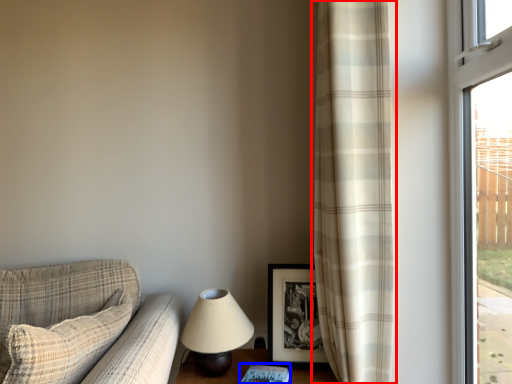
Question: Among these objects, which one is farthest to the camera, curtain (highlighted by a red box) or book (highlighted by a blue box)?

Choices:
 (A) curtain
 (B) book

Answer: (A)